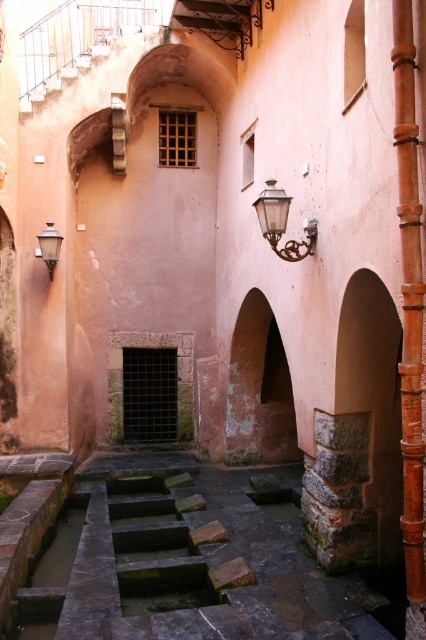
Question: Considering the real-world distances, which object is farthest from the matte white wall-mounted light fixture at upper left?

Choices:
 (A) matte glass wall lamp at center
 (B) smooth reddish-brown pipe at right

Answer: (B)

Question: Can you confirm if smooth reddish-brown pipe at right is positioned below matte white wall-mounted light fixture at upper left?

Choices:
 (A) yes
 (B) no

Answer: (A)

Question: From the image, what is the correct spatial relationship of dark stone troughs at center in relation to matte white wall-mounted light fixture at upper left?

Choices:
 (A) left
 (B) right

Answer: (B)

Question: Which object is positioned farthest from the matte glass wall lamp at center?

Choices:
 (A) matte white wall-mounted light fixture at upper left
 (B) smooth reddish-brown pipe at right
 (C) smooth pink stone archway at center
 (D) dark stone troughs at center

Answer: (A)

Question: Which of these objects is positioned farthest from the matte glass wall lamp at center?

Choices:
 (A) smooth reddish-brown pipe at right
 (B) rusty stone pillar at right

Answer: (B)

Question: Where is dark stone troughs at center located in relation to smooth reddish-brown pipe at right in the image?

Choices:
 (A) above
 (B) below

Answer: (B)